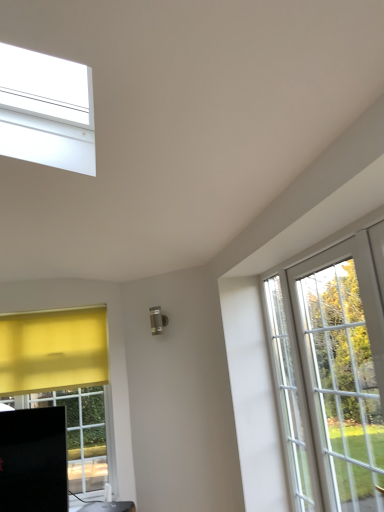
Find the location of `matte black router at lower left`. matte black router at lower left is located at coordinates (109, 506).

Image resolution: width=384 pixels, height=512 pixels. What do you see at coordinates (109, 506) in the screenshot?
I see `matte black router at lower left` at bounding box center [109, 506].

Describe the element at coordinates (291, 397) in the screenshot. The height and width of the screenshot is (512, 384). I see `white glass screen door at right` at that location.

What is the approximate width of white glass screen door at right?

white glass screen door at right is 7.66 centimeters wide.

You are a GUI agent. You are given a task and a screenshot of the screen. Output one action in this format:
    pyautogui.click(x=<x>, y=<y>)
    Task: Click on the white glass screen door at right
    
    Given the screenshot: What is the action you would take?
    pyautogui.click(x=291, y=397)

Identify the location of matte black router at lower left. (109, 506).

Looking at this image, which is more to the right, matte black router at lower left or white glass screen door at right?

Positioned to the right is white glass screen door at right.

Between matte black router at lower left and white glass screen door at right, which one is positioned in front?

Positioned in front is white glass screen door at right.

Is point (133, 502) more distant than point (263, 295)?

Yes, it is behind point (263, 295).

From the image's perspective, would you say matte black router at lower left is shown under white glass screen door at right?

Correct, matte black router at lower left appears lower than white glass screen door at right in the image.

From a real-world perspective, does matte black router at lower left stand above white glass screen door at right?

No, from a real-world perspective, matte black router at lower left is not on top of white glass screen door at right.

Is matte black router at lower left wider than white glass screen door at right?

Indeed, matte black router at lower left has a greater width compared to white glass screen door at right.

Which of these two, matte black router at lower left or white glass screen door at right, stands shorter?

matte black router at lower left.

Considering the relative sizes of matte black router at lower left and white glass screen door at right in the image provided, is matte black router at lower left bigger than white glass screen door at right?

No, matte black router at lower left is not bigger than white glass screen door at right.

Is matte black router at lower left surrounding white glass screen door at right?

No, matte black router at lower left does not contain white glass screen door at right.

Are matte black router at lower left and white glass screen door at right located far from each other?

Yes.

Is matte black router at lower left oriented away from white glass screen door at right?

No, white glass screen door at right is not at the back of matte black router at lower left.

How far apart are matte black router at lower left and white glass screen door at right?

matte black router at lower left and white glass screen door at right are 1.56 meters apart.

Locate an element on the screen. The image size is (384, 512). furniture below the white glass screen door at right (from a real-world perspective) is located at coordinates 109,506.

Considering the positions of objects white glass screen door at right and matte black router at lower left in the image provided, who is more to the left, white glass screen door at right or matte black router at lower left?

matte black router at lower left.

Does white glass screen door at right lie in front of matte black router at lower left?

Yes, the depth of white glass screen door at right is less than that of matte black router at lower left.

Which is closer, (288, 295) or (126, 506)?

The point (288, 295) is closer.

From the image's perspective, which one is positioned lower, white glass screen door at right or matte black router at lower left?

matte black router at lower left appears lower in the image.

From a real-world perspective, is white glass screen door at right positioned above or below matte black router at lower left?

white glass screen door at right is situated higher than matte black router at lower left in the real world.

Considering the sizes of white glass screen door at right and matte black router at lower left in the image, is white glass screen door at right wider or thinner than matte black router at lower left?

Considering their sizes, white glass screen door at right looks slimmer than matte black router at lower left.

Which of these two, white glass screen door at right or matte black router at lower left, stands taller?

With more height is white glass screen door at right.

Who is bigger, white glass screen door at right or matte black router at lower left?

With larger size is white glass screen door at right.

Choose the correct answer: Is white glass screen door at right inside matte black router at lower left or outside it?

The correct answer is: outside.

Is white glass screen door at right placed right next to matte black router at lower left?

white glass screen door at right and matte black router at lower left are clearly separated.

Is white glass screen door at right aimed at matte black router at lower left?

No, white glass screen door at right does not turn towards matte black router at lower left.

How different are the orientations of white glass screen door at right and matte black router at lower left in degrees?

They differ by 62.4 degrees in their facing directions.

In the image, there is a white glass screen door at right. Find the location of `furniture below it (from a real-world perspective)`. furniture below it (from a real-world perspective) is located at coordinates (109, 506).

This screenshot has height=512, width=384. In order to click on furniture below the white glass screen door at right (from the image's perspective) in this screenshot , I will do `click(109, 506)`.

Image resolution: width=384 pixels, height=512 pixels. In the image, there is a matte black router at lower left. In order to click on screen door above it (from the image's perspective) in this screenshot , I will do `click(291, 397)`.